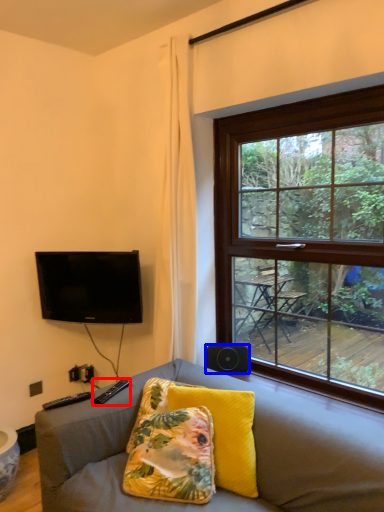
Question: Among these objects, which one is farthest to the camera, remote (highlighted by a red box) or loudspeaker (highlighted by a blue box)?

Choices:
 (A) remote
 (B) loudspeaker

Answer: (B)